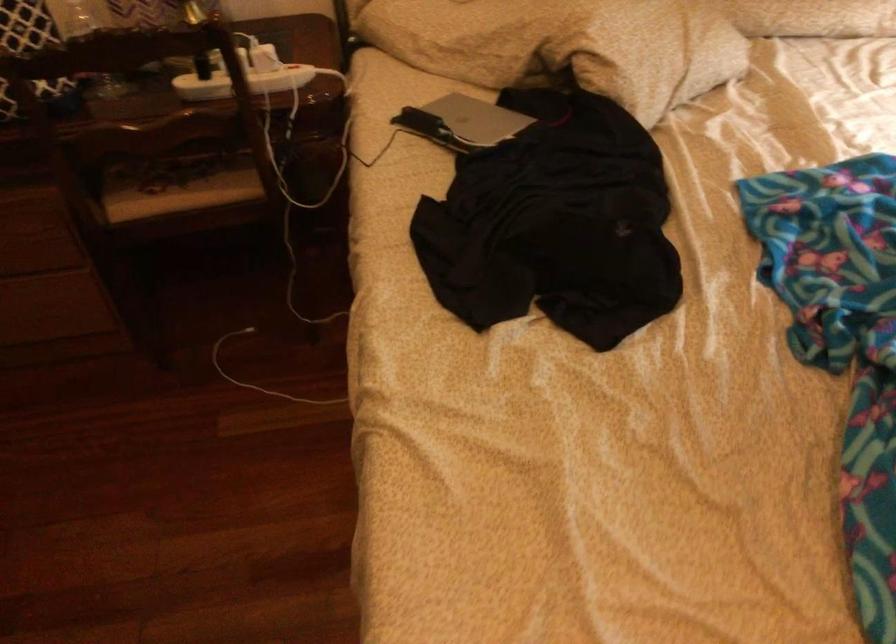
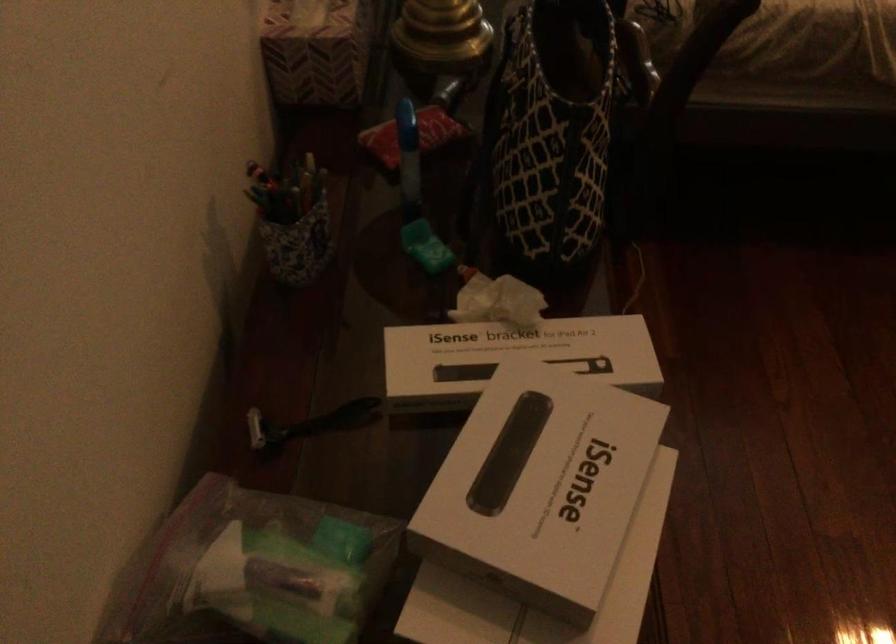
Question: I am providing you with two images of the same scene from different viewpoints. Please identify which objects are invisible in image2.

Choices:
 (A) black handle tool
 (B) white charging cable
 (C) blue drawer knob
 (D) clear plastic bag

Answer: (B)